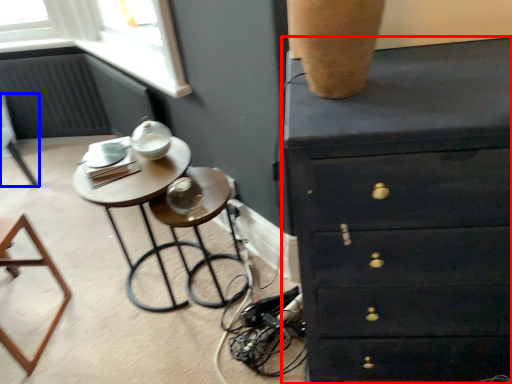
Question: Which object is further to the camera taking this photo, chest of drawers (highlighted by a red box) or furniture (highlighted by a blue box)?

Choices:
 (A) chest of drawers
 (B) furniture

Answer: (B)